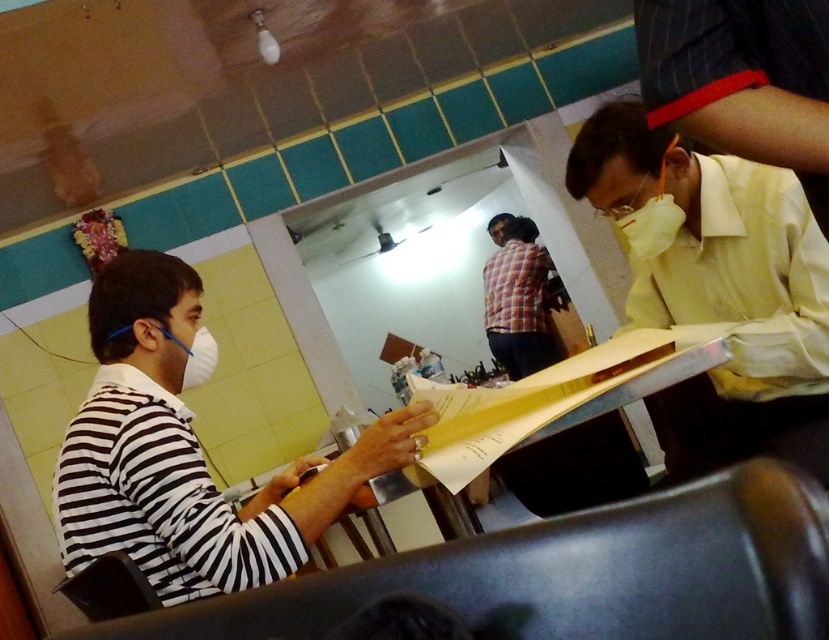
Question: Estimate the real-world distances between objects in this image. Which object is farther from the white matte mask at left?

Choices:
 (A) white matte mask at upper right
 (B) yellow cotton shirt at right

Answer: (B)

Question: Which point is farther to the camera?

Choices:
 (A) white matte mask at upper right
 (B) white matte mask at left
 (C) striped fabric shirt at left
 (D) yellow cotton shirt at right

Answer: (A)

Question: Is yellow smooth shirt at right positioned in front of yellow cotton shirt at right?

Choices:
 (A) yes
 (B) no

Answer: (B)

Question: Estimate the real-world distances between objects in this image. Which object is closer to the striped fabric shirt at left?

Choices:
 (A) yellow smooth shirt at right
 (B) yellow cotton shirt at right
 (C) white matte mask at left

Answer: (C)

Question: Where is yellow smooth shirt at right located in relation to striped fabric shirt at left in the image?

Choices:
 (A) above
 (B) below

Answer: (A)

Question: Does yellow smooth shirt at right have a greater width compared to yellow cotton shirt at right?

Choices:
 (A) no
 (B) yes

Answer: (B)